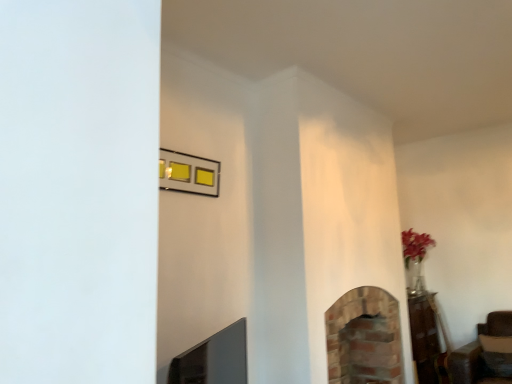
Question: From the image's perspective, is brick fireplace at lower center, the second fireplace viewed from the right, located above or below brick fireplace at center, which is the 1th fireplace from right to left?

Choices:
 (A) below
 (B) above

Answer: (B)

Question: Is brick fireplace at lower center, positioned as the 2th fireplace in back-to-front order, spatially inside brick fireplace at center, which is the 1th fireplace from right to left, or outside of it?

Choices:
 (A) inside
 (B) outside

Answer: (B)

Question: Based on their relative distances, which object is farther from the brick fireplace at lower center, the second fireplace viewed from the right?

Choices:
 (A) brick fireplace at center, which is the 1th fireplace from right to left
 (B) metallic gold picture frame at upper center

Answer: (A)

Question: Which object is positioned closest to the brick fireplace at lower center, the second fireplace viewed from the right?

Choices:
 (A) metallic gold picture frame at upper center
 (B) brick fireplace at center, which appears as the 2th fireplace when viewed from the front

Answer: (A)